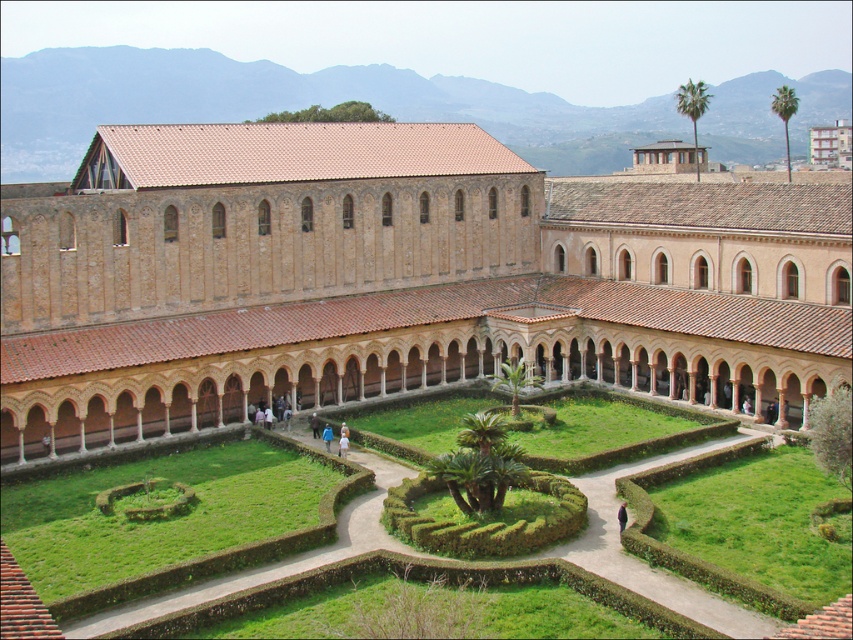
Is green grass at center thinner than blue fabric at center?

No.

Is green grass at center to the right of blue fabric at center from the viewer's perspective?

Yes, green grass at center is to the right of blue fabric at center.

Between point (738, 593) and point (329, 433), which one is positioned in front?

Point (738, 593)

This screenshot has width=853, height=640. What are the coordinates of `green grass at center` in the screenshot? It's located at (131, 589).

Is point (814, 376) positioned behind point (328, 429)?

No.

Which is more to the right, brown brick building at center or blue fabric at center?

brown brick building at center is more to the right.

Is point (59, 385) more distant than point (332, 436)?

No, (59, 385) is closer to viewer.

Where is `brown brick building at center`? This screenshot has width=853, height=640. brown brick building at center is located at coordinates (392, 278).

Does brown brick building at center come in front of green grass at center?

No.

Looking at this image, does brown brick building at center have a smaller size compared to green grass at center?

No, brown brick building at center is not smaller than green grass at center.

The image size is (853, 640). Find the location of `brown brick building at center`. brown brick building at center is located at coordinates (392, 278).